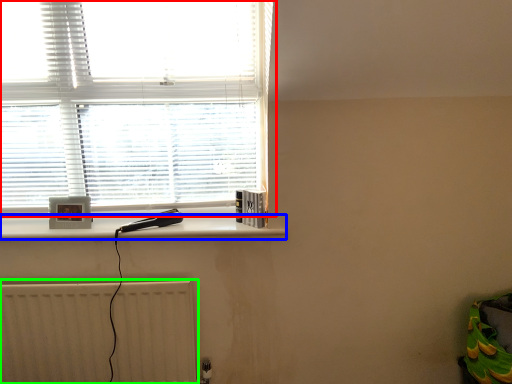
Question: Which object is positioned closest to window (highlighted by a red box)? Select from ledge (highlighted by a blue box) and radiator (highlighted by a green box).

Choices:
 (A) ledge
 (B) radiator

Answer: (A)